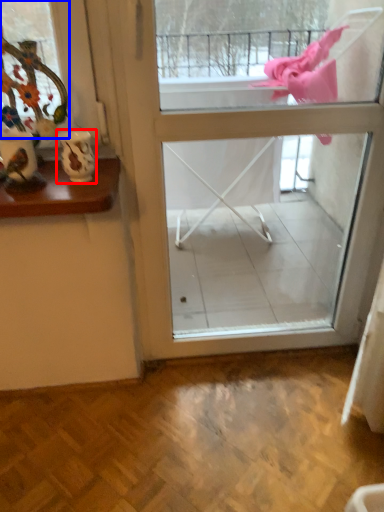
Question: Which of the following is the farthest to the observer, vase (highlighted by a red box) or window (highlighted by a blue box)?

Choices:
 (A) vase
 (B) window

Answer: (A)